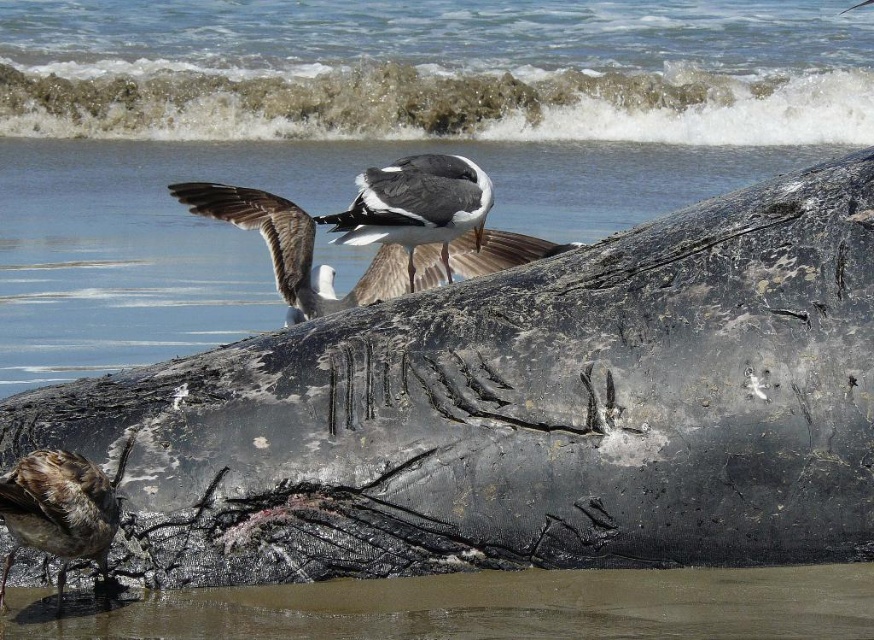
Who is more distant from viewer, [415,605] or [336,228]?

Positioned behind is point [336,228].

Who is more distant from viewer, (507, 588) or (431, 189)?

Point (431, 189)

Find the location of `smooth sand beach at lower center`. smooth sand beach at lower center is located at coordinates (486, 608).

Is point (702, 524) less distant than point (819, 620)?

No.

Is charred wood log at center positioned behind smooth sand beach at lower center?

Yes.

Does point (521, 278) lie behind point (392, 609)?

Yes.

Find the location of a particular element. This screenshot has height=640, width=874. charred wood log at center is located at coordinates [x=519, y=412].

Is black textured whale at center thinner than brown speckled feathers at lower left?

No, black textured whale at center is not thinner than brown speckled feathers at lower left.

Between point (227, 332) and point (88, 465), which one is positioned behind?

The point (227, 332) is behind.

Image resolution: width=874 pixels, height=640 pixels. In order to click on black textured whale at center in this screenshot , I will do `click(369, 134)`.